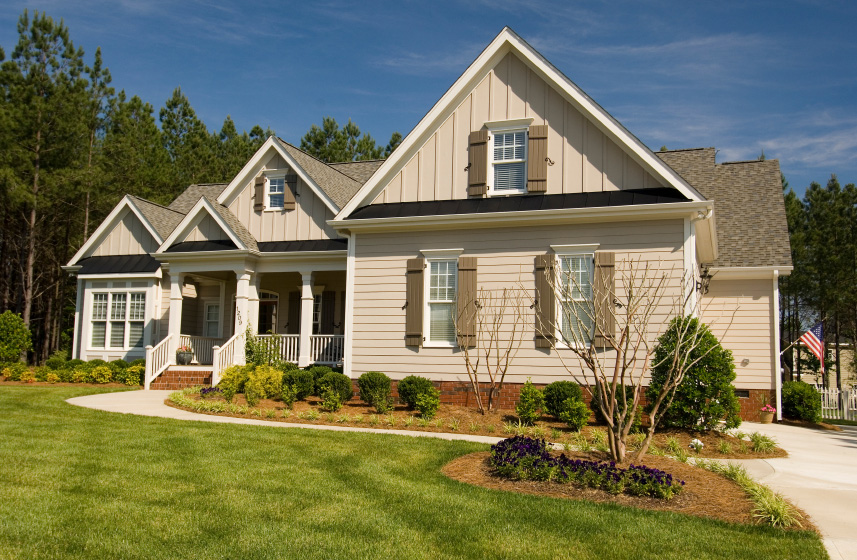
Locate an element on the screen. This screenshot has height=560, width=857. shutters is located at coordinates (536, 151), (474, 171), (464, 294), (411, 284), (546, 286), (603, 275), (327, 312), (296, 314), (285, 196), (255, 196).